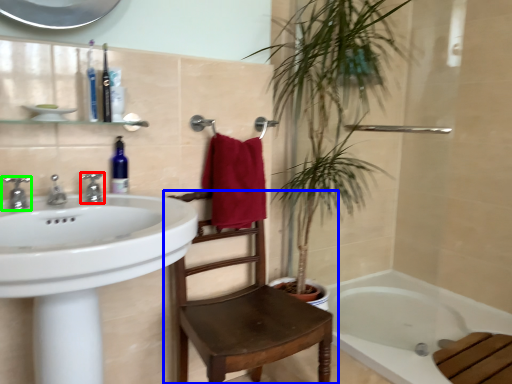
Question: Considering the real-world distances, which object is closest to tap (highlighted by a red box)? chair (highlighted by a blue box) or tap (highlighted by a green box).

Choices:
 (A) chair
 (B) tap

Answer: (B)